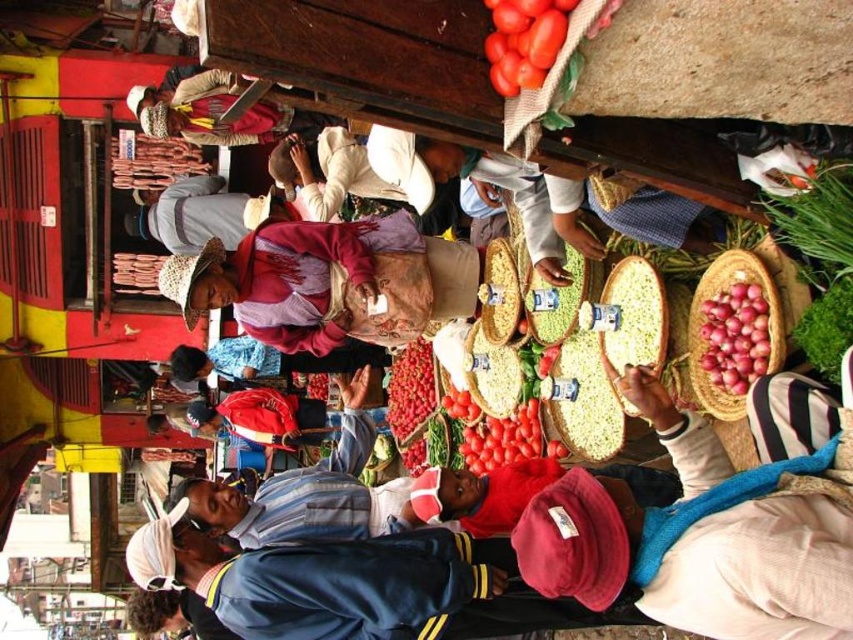
Question: Which point appears farthest from the camera in this image?

Choices:
 (A) (689, 428)
 (B) (167, 228)

Answer: (B)

Question: Does smooth red tomatoes at center have a lesser width compared to smooth red onion at right?

Choices:
 (A) yes
 (B) no

Answer: (B)

Question: Considering the real-world distances, which object is closest to the smooth red onion at right?

Choices:
 (A) smooth red tomatoes at center
 (B) rustic straw hat at center
 (C) brown woven basket at right
 (D) striped fabric shirt at upper right

Answer: (C)

Question: Which point appears farthest from the camera in this image?

Choices:
 (A) (268, 205)
 (B) (415, 401)

Answer: (A)

Question: Is the position of blue fabric jacket at lower left less distant than that of brown woven basket at right?

Choices:
 (A) yes
 (B) no

Answer: (B)

Question: Is rustic straw hat at center thinner than smooth red tomatoes at center?

Choices:
 (A) no
 (B) yes

Answer: (A)